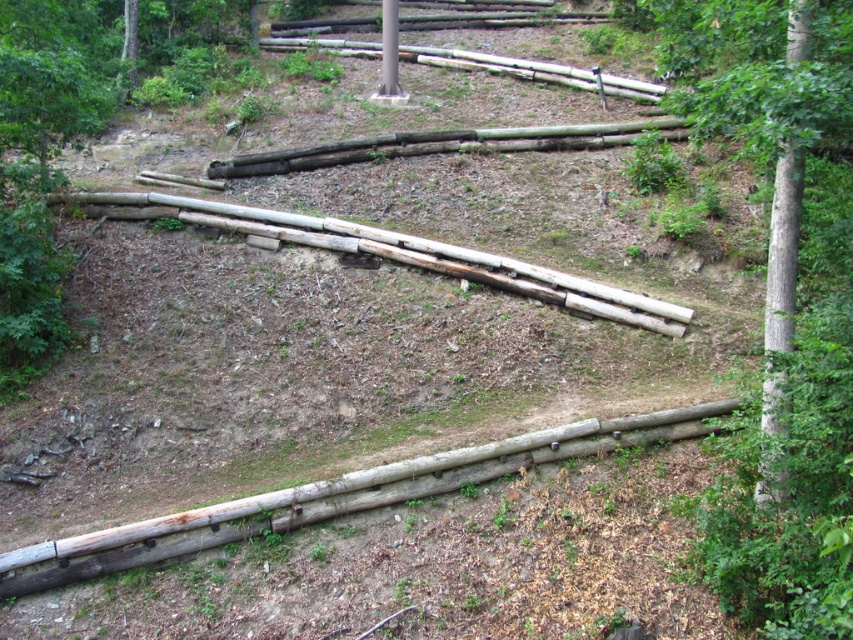
You are standing at the point labeled point (786, 172) in the image. You want to walk to the camera position. Is the path directly ahead of you uphill or downhill?

The path directly ahead of you to the camera position is downhill since the camera is 8.22 meters away from the point (786, 172), and the terrain is sloped.